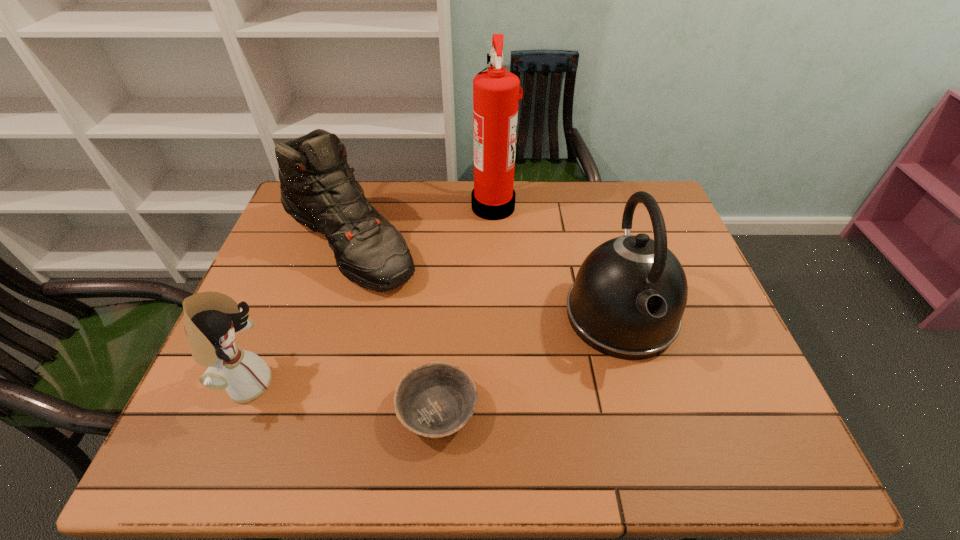
Where is `vacant space at the near edge of the desktop`? This screenshot has width=960, height=540. vacant space at the near edge of the desktop is located at coordinates (424, 451).

In the image, there is a desktop. Where is `vacant space at the left edge`? The image size is (960, 540). vacant space at the left edge is located at coordinates (277, 296).

Find the location of a particular element. Image resolution: width=960 pixels, height=540 pixels. free space at the right edge of the desktop is located at coordinates (694, 356).

The height and width of the screenshot is (540, 960). Identify the location of vacant space at the near left corner of the desktop. (203, 432).

Identify the location of free space that is in between the kettle and the shortest object. (529, 363).

Locate an element on the screen. vacant area that lies between the kettle and the bowl is located at coordinates (529, 363).

The height and width of the screenshot is (540, 960). In order to click on free spot between the bowl and the fire extinguisher in this screenshot , I will do `click(466, 308)`.

Where is `unoccupied area between the kettle and the bowl`? This screenshot has height=540, width=960. unoccupied area between the kettle and the bowl is located at coordinates (529, 363).

Identify the location of free space between the bowl and the kettle. (529, 363).

Locate an element on the screen. Image resolution: width=960 pixels, height=540 pixels. unoccupied position between the bowl and the rightmost object is located at coordinates pos(529,363).